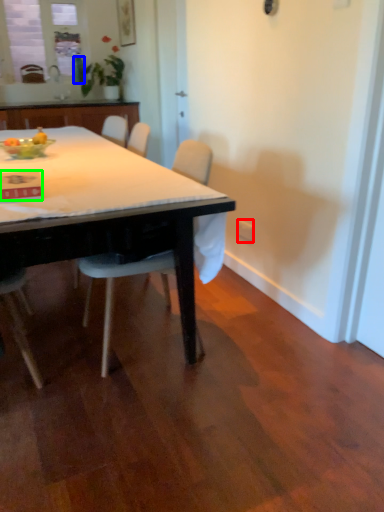
Question: Estimate the real-world distances between objects in this image. Which object is closer to power outlet (highlighted by a red box), bottle (highlighted by a blue box) or kitchen & dining room table (highlighted by a green box)?

Choices:
 (A) bottle
 (B) kitchen & dining room table

Answer: (B)